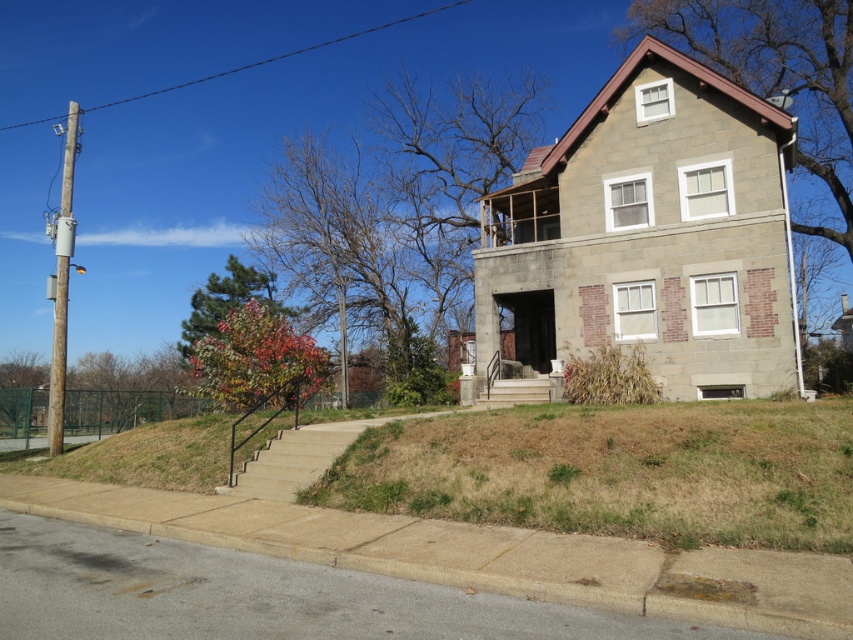
In the scene shown: Who is lower down, gray concrete curb at lower center or stone steps at center?

Positioned lower is gray concrete curb at lower center.

Which is behind, point (331, 588) or point (521, 394)?

The point (521, 394) is behind.

Is point (695, 573) positioned before point (506, 388)?

Yes, point (695, 573) is closer to viewer.

What are the coordinates of `gray concrete curb at lower center` in the screenshot? It's located at (482, 556).

In the scene shown: Does concrete stairs at lower left have a greater width compared to stone steps at center?

Correct, the width of concrete stairs at lower left exceeds that of stone steps at center.

Which is behind, point (250, 486) or point (526, 403)?

The point (526, 403) is behind.

Identify the location of concrete stairs at lower left. The image size is (853, 640). (300, 458).

Which is above, gray concrete curb at lower center or concrete stairs at lower left?

concrete stairs at lower left

Does point (581, 593) lie behind point (245, 465)?

No, it is in front of (245, 465).

You are a GUI agent. You are given a task and a screenshot of the screen. Output one action in this format:
    pyautogui.click(x=<x>, y=<y>)
    Task: Click on the gray concrete curb at lower center
    This screenshot has width=853, height=640.
    Given the screenshot: What is the action you would take?
    pyautogui.click(x=482, y=556)